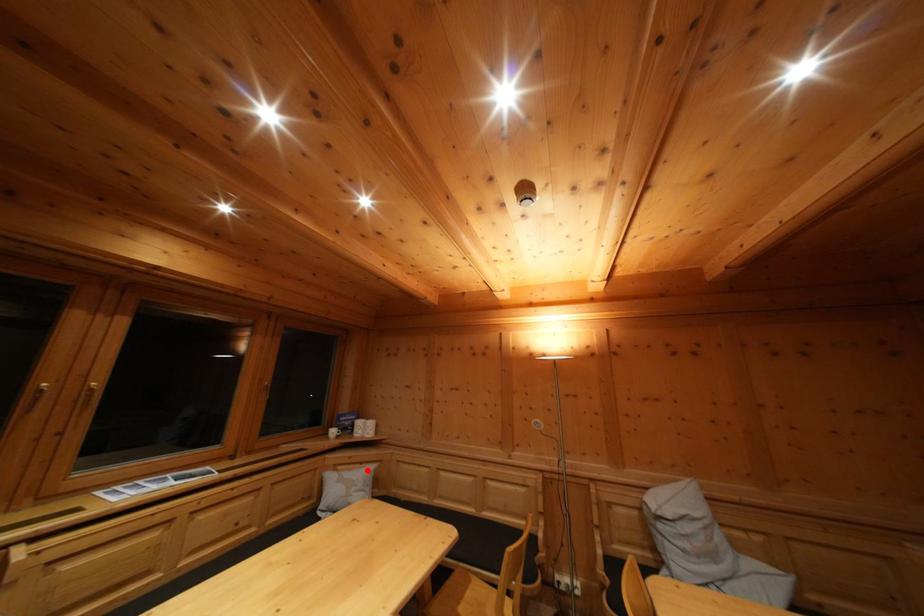
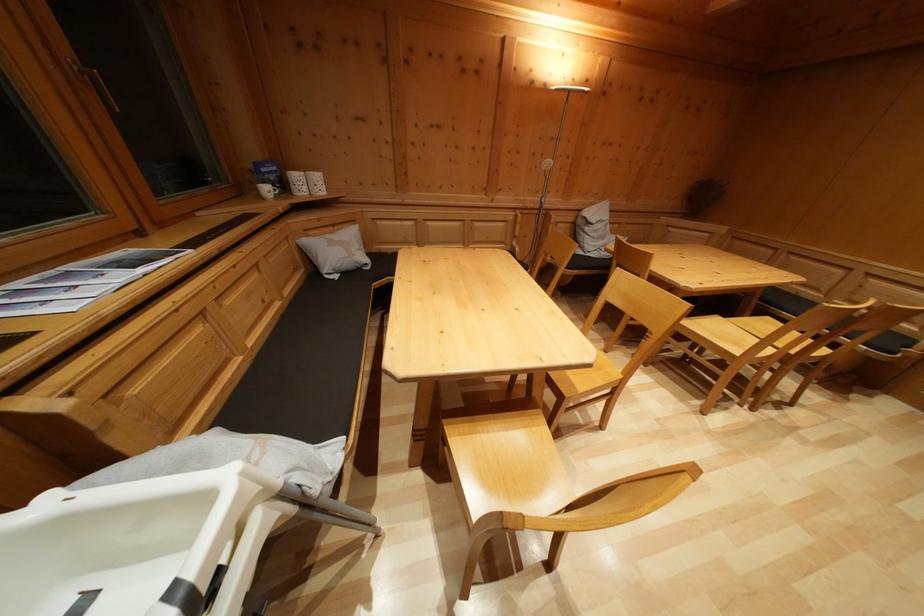
Where in the second image is the point corresponding to the highlighted location from the first image?

(338, 233)